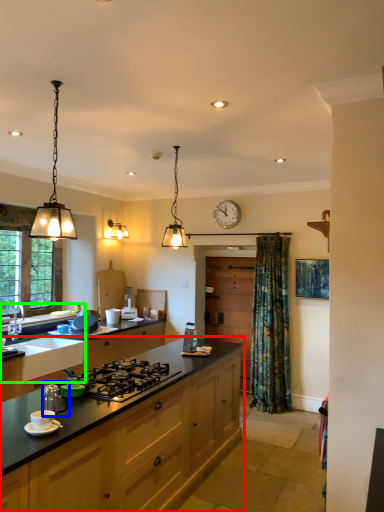
Question: Which object is the closest to the cabinetry (highlighted by a red box)? Choose among these: tea pot (highlighted by a blue box) or sink (highlighted by a green box).

Choices:
 (A) tea pot
 (B) sink

Answer: (A)